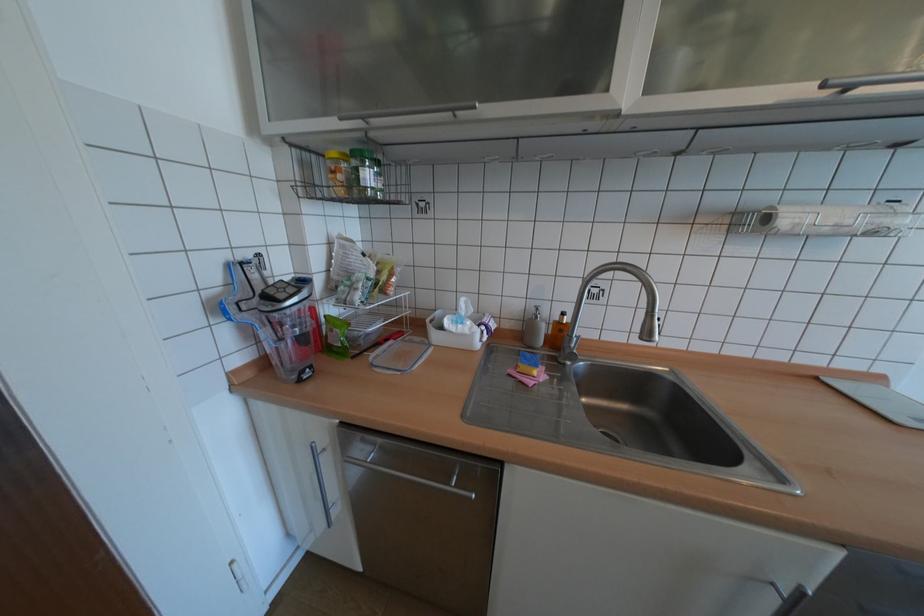
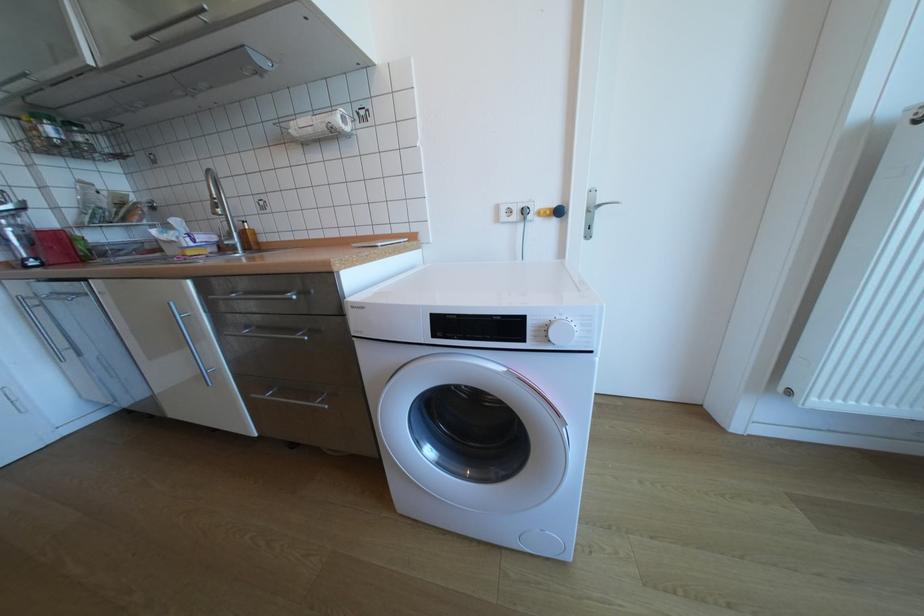
The point at [881,227] is marked in the first image. Where is the corresponding point in the second image?

(334, 124)